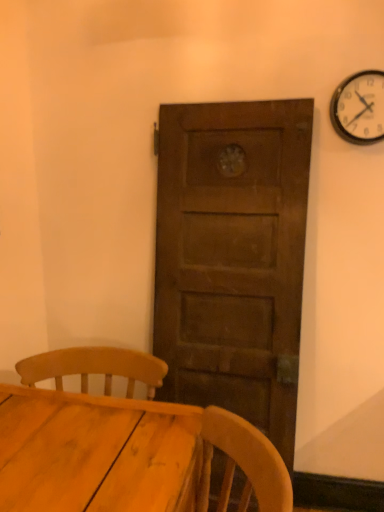
Question: Is metallic silver clock at upper right to the left or to the right of wooden table at lower left in the image?

Choices:
 (A) right
 (B) left

Answer: (A)

Question: From the image's perspective, is metallic silver clock at upper right positioned above or below wooden table at lower left?

Choices:
 (A) above
 (B) below

Answer: (A)

Question: Considering their positions, is metallic silver clock at upper right located in front of or behind wooden table at lower left?

Choices:
 (A) behind
 (B) front

Answer: (A)

Question: Looking at their shapes, would you say wooden table at lower left is wider or thinner than metallic silver clock at upper right?

Choices:
 (A) wide
 (B) thin

Answer: (A)

Question: Is wooden table at lower left taller or shorter than metallic silver clock at upper right?

Choices:
 (A) tall
 (B) short

Answer: (A)

Question: From a real-world perspective, relative to metallic silver clock at upper right, is wooden table at lower left vertically above or below?

Choices:
 (A) above
 (B) below

Answer: (B)

Question: Is wooden table at lower left inside or outside of metallic silver clock at upper right?

Choices:
 (A) inside
 (B) outside

Answer: (B)